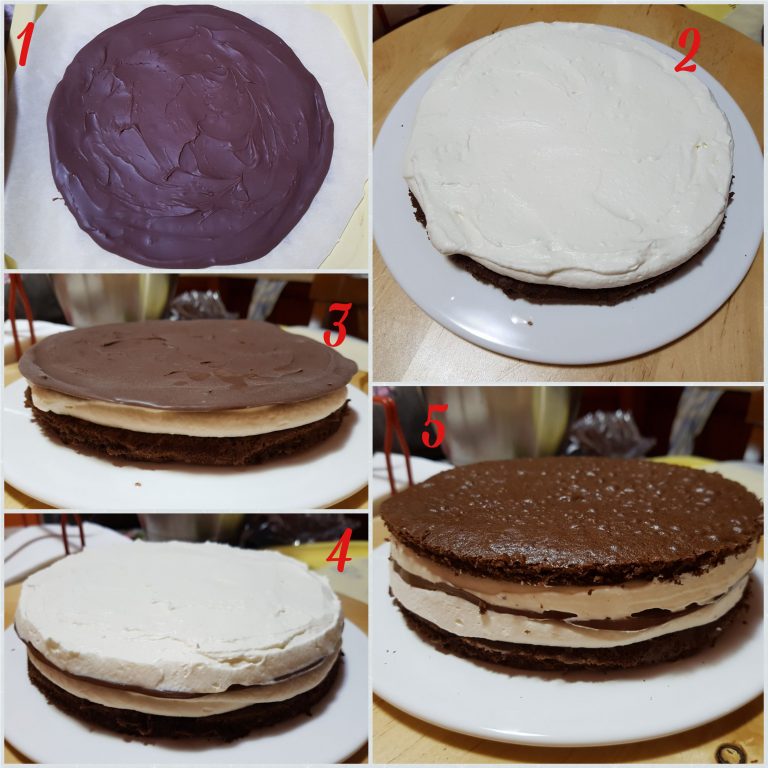
The image size is (768, 768). I want to click on napkin, so click(x=27, y=548), click(x=399, y=468), click(x=25, y=330).